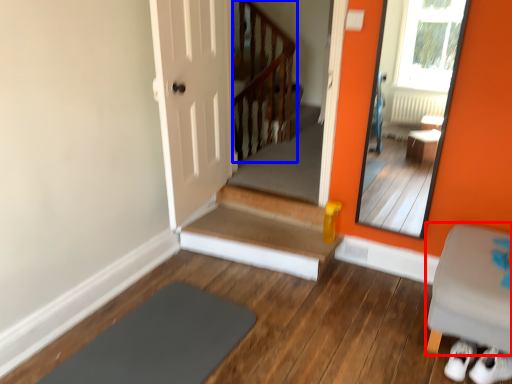
Question: Which object is closer to the camera taking this photo, furniture (highlighted by a red box) or balustrade (highlighted by a blue box)?

Choices:
 (A) furniture
 (B) balustrade

Answer: (A)